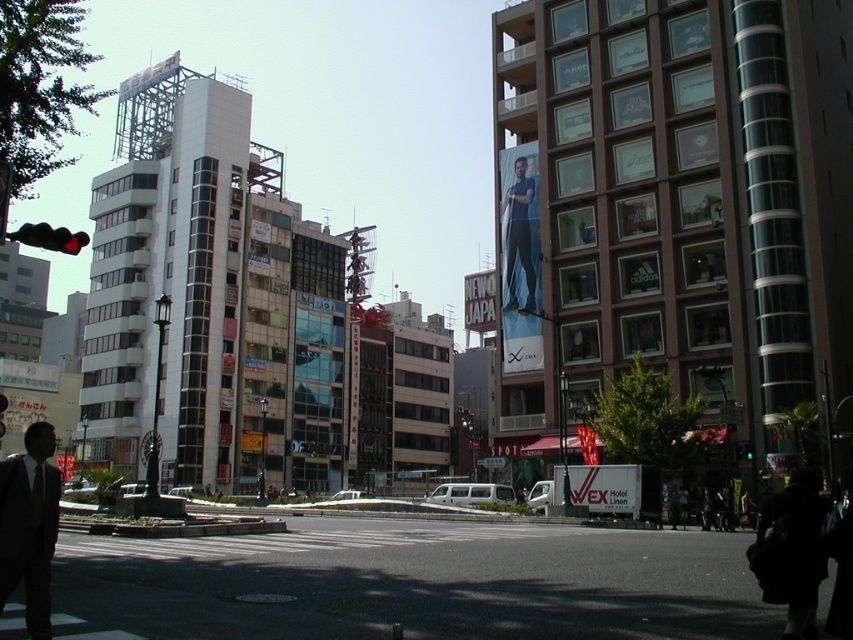
Question: Is matte blue jeans at center further to camera compared to green glass traffic light at lower right?

Choices:
 (A) no
 (B) yes

Answer: (B)

Question: Which object is the closest to the white fabric sign at center?

Choices:
 (A) matte black suit at lower left
 (B) red glass traffic light at upper left

Answer: (B)

Question: Does matte black suit at lower left appear over white fabric sign at center?

Choices:
 (A) yes
 (B) no

Answer: (B)

Question: Estimate the real-world distances between objects in this image. Which object is closer to the matte black suit at lower left?

Choices:
 (A) red glass traffic light at upper left
 (B) matte blue jeans at center
 (C) green glass traffic light at lower right

Answer: (A)

Question: Which is farther from the matte blue jeans at center?

Choices:
 (A) red glass traffic light at upper left
 (B) matte black suit at lower left

Answer: (B)

Question: Is red glass traffic light at upper left wider than green glass traffic light at lower right?

Choices:
 (A) no
 (B) yes

Answer: (B)